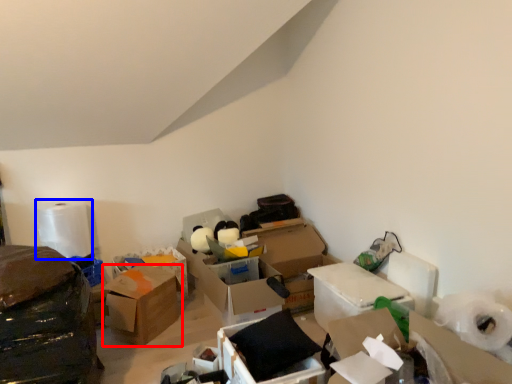
Question: Which of the following is the farthest to the observer, box (highlighted by a red box) or toilet paper (highlighted by a blue box)?

Choices:
 (A) box
 (B) toilet paper

Answer: (B)